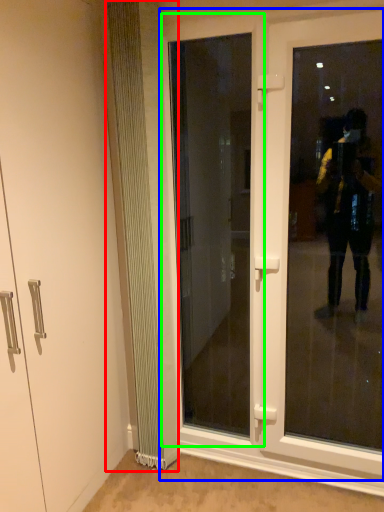
Question: Considering the real-world distances, which object is farthest from radiator (highlighted by a red box)? door (highlighted by a blue box) or door (highlighted by a green box)?

Choices:
 (A) door
 (B) door

Answer: (B)